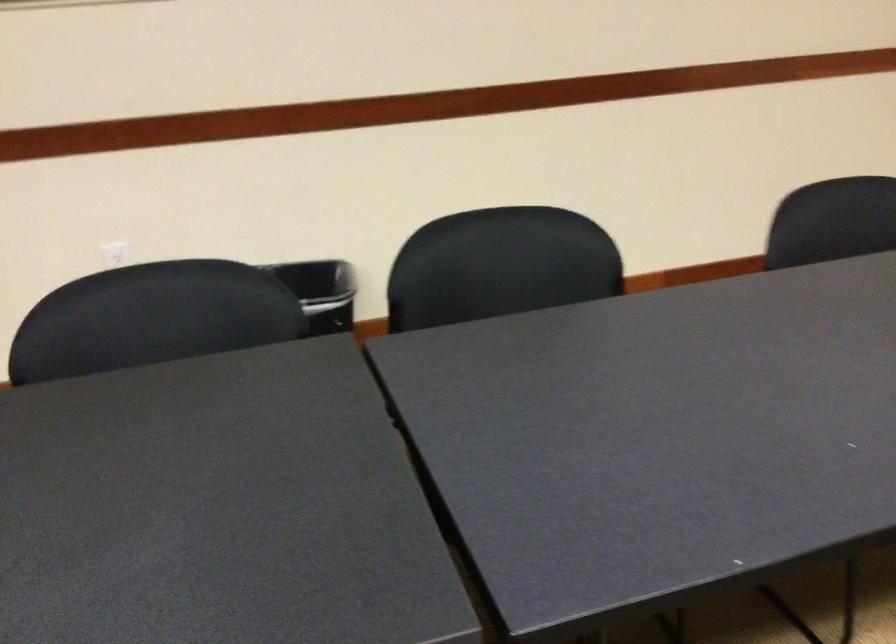
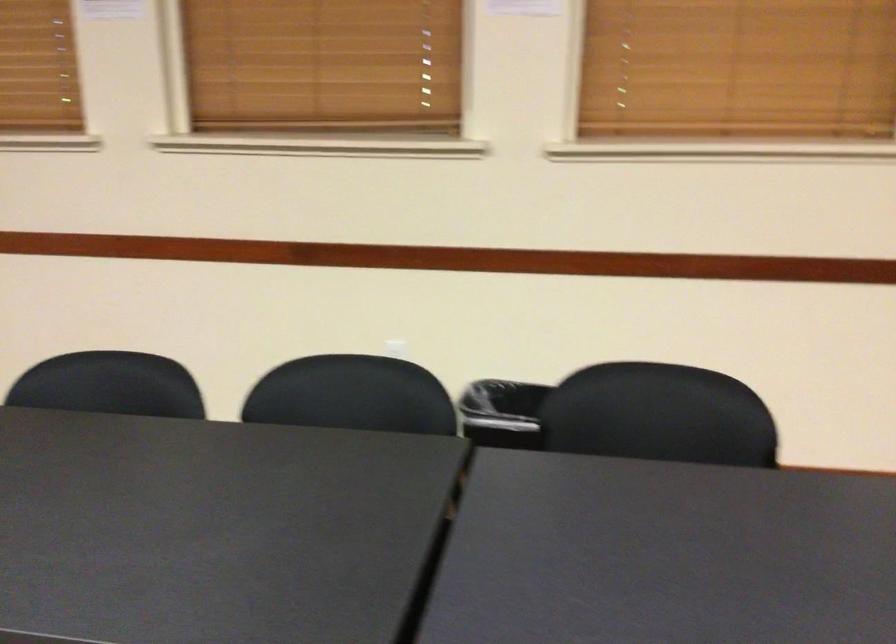
Question: Based on the continuous images, in which direction is the camera rotating? Reply with the corresponding letter.

Choices:
 (A) Left
 (B) Right
 (C) Up
 (D) Down

Answer: (A)